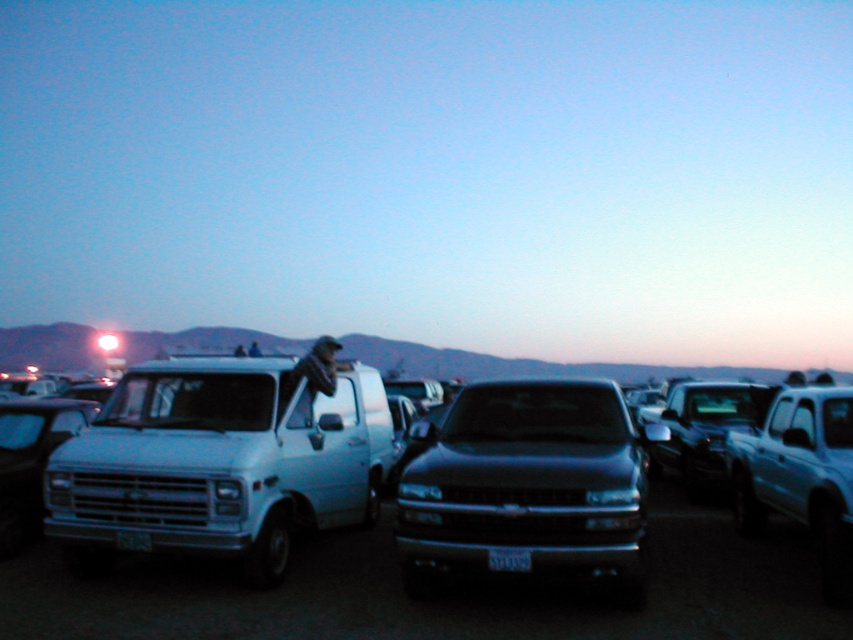
You are a delivery driver who needs to park your truck in the parking lot shown. You observe the metallic silver truck at center and the black plastic license plate at center. Which object is wider?

The metallic silver truck at center is wider than the black plastic license plate at center.